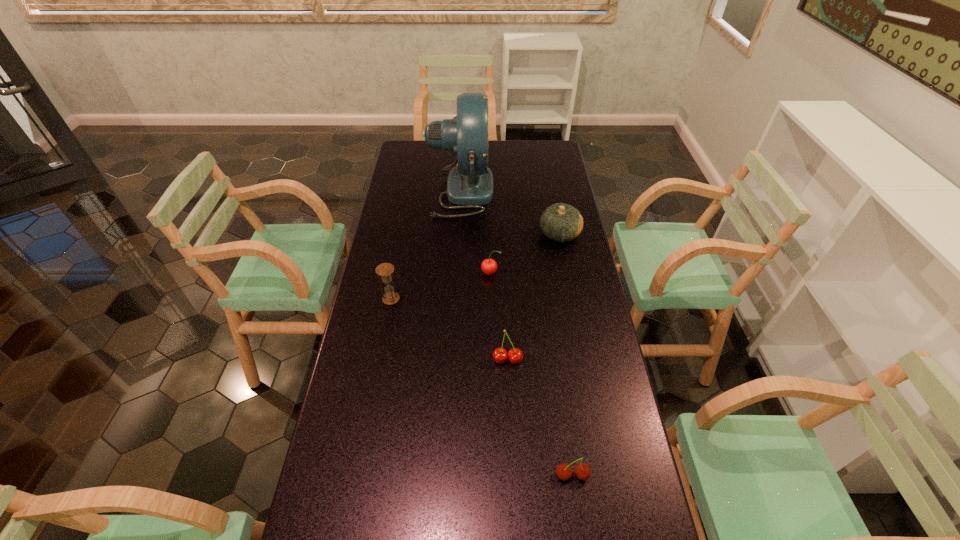
Identify the location of vacant region that satisfies the following two spatial constraints: 1. in front of the farthest cherry to blow air; 2. on the left side of the farthest object. (456, 273).